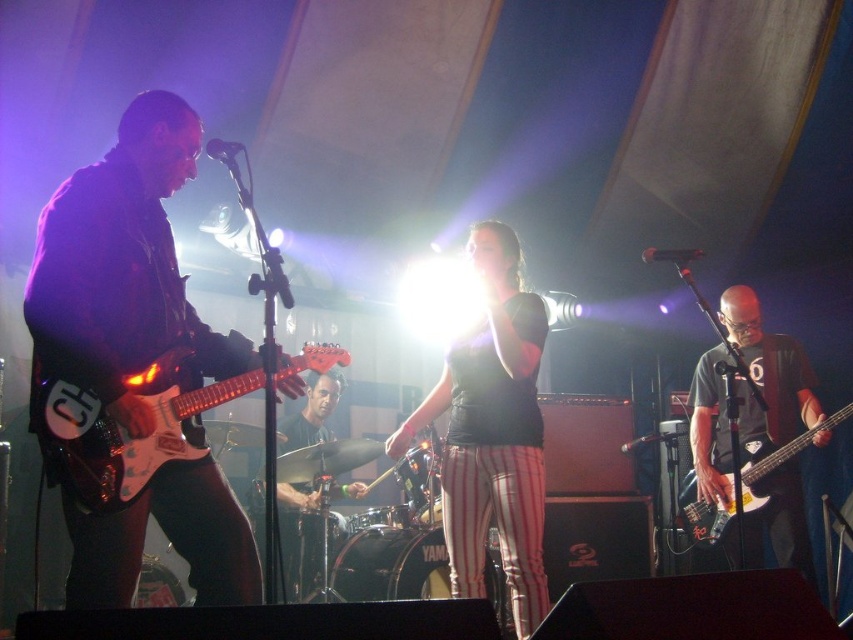
Question: Among these points, which one is farthest from the camera?

Choices:
 (A) (282, 557)
 (B) (103, 465)

Answer: (A)

Question: Which point appears closest to the camera in this image?

Choices:
 (A) (770, 467)
 (B) (294, 532)

Answer: (A)

Question: Is black matte shirt at center above matte black bass guitar at right?

Choices:
 (A) no
 (B) yes

Answer: (B)

Question: Does black leather drumsticks at center appear over matte black bass at right?

Choices:
 (A) no
 (B) yes

Answer: (A)

Question: Can you confirm if black matte shirt at center is positioned to the right of matte black bass at right?

Choices:
 (A) yes
 (B) no

Answer: (B)

Question: Which point is farther to the camera?

Choices:
 (A) (283, 531)
 (B) (543, 614)

Answer: (A)